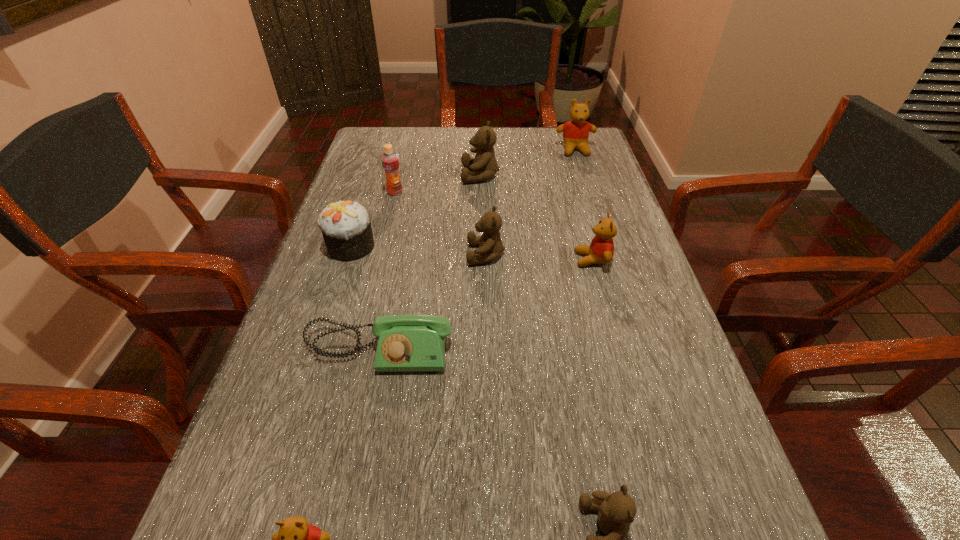
Identify the location of vacant region located 0.300m on the front-facing side of the second nearest brown teddy bear. This screenshot has width=960, height=540. (337, 254).

You are a GUI agent. You are given a task and a screenshot of the screen. Output one action in this format:
    pyautogui.click(x=<x>, y=<y>)
    Task: Click on the vacant space situated on the back of the cupcake
    This screenshot has height=540, width=960.
    Given the screenshot: What is the action you would take?
    pyautogui.click(x=382, y=153)

Locate an element on the screen. The image size is (960, 540). vacant area located 0.250m on the dial of the shortest object is located at coordinates (342, 530).

Image resolution: width=960 pixels, height=540 pixels. In order to click on object at the far edge in this screenshot , I will do `click(576, 131)`.

In order to click on orange juice present at the left edge in this screenshot , I will do `click(390, 161)`.

The width and height of the screenshot is (960, 540). Find the location of `cupcake present at the left edge`. cupcake present at the left edge is located at coordinates (346, 227).

Locate an element on the screen. This screenshot has width=960, height=540. telephone at the left edge is located at coordinates [x=406, y=343].

Where is `object situated at the far right corner`? object situated at the far right corner is located at coordinates (576, 131).

At what (x,y) coordinates should I click in order to perform the action: click on vacant space at the far edge of the desktop. Please return your answer as a coordinate pair (x, y). This screenshot has width=960, height=540. Looking at the image, I should click on (441, 158).

In the image, there is a desktop. Where is `vacant space at the left edge`? vacant space at the left edge is located at coordinates (305, 452).